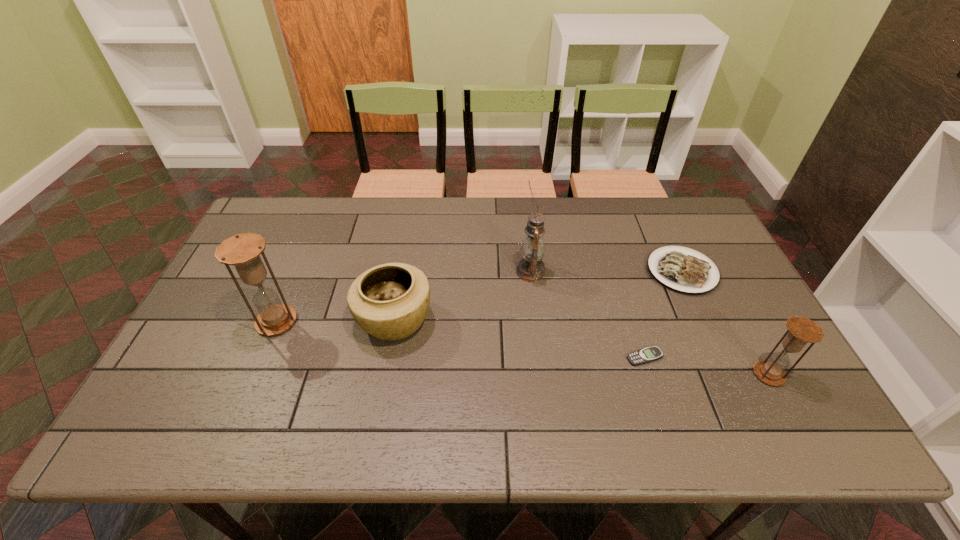
In order to click on the farther hourglass in this screenshot , I will do `click(243, 251)`.

You are a GUI agent. You are given a task and a screenshot of the screen. Output one action in this format:
    pyautogui.click(x=<x>, y=<y>)
    Task: Click on the fifth shortest object
    The width and height of the screenshot is (960, 540).
    Given the screenshot: What is the action you would take?
    pyautogui.click(x=243, y=251)

Identify the location of the shorter hourglass. (802, 330).

You are a GUI agent. You are given a task and a screenshot of the screen. Output one action in this format:
    pyautogui.click(x=<x>, y=<y>)
    Task: Click on the nearer hourglass
    
    Given the screenshot: What is the action you would take?
    pyautogui.click(x=802, y=330)

The width and height of the screenshot is (960, 540). Find the location of `the second shortest object`. the second shortest object is located at coordinates (684, 272).

At what (x,y) coordinates should I click in order to perform the action: click on oil lamp. Please return your answer as a coordinate pair (x, y). The height and width of the screenshot is (540, 960). Looking at the image, I should click on click(x=530, y=268).

At what (x,y) coordinates should I click in order to perform the action: click on the tallest object. Please return your answer as a coordinate pair (x, y). Looking at the image, I should click on (530, 268).

The width and height of the screenshot is (960, 540). What are the coordinates of `pottery` in the screenshot? It's located at (390, 301).

Image resolution: width=960 pixels, height=540 pixels. I want to click on the third shortest object, so tap(390, 301).

This screenshot has width=960, height=540. Identify the location of beeper. (646, 355).